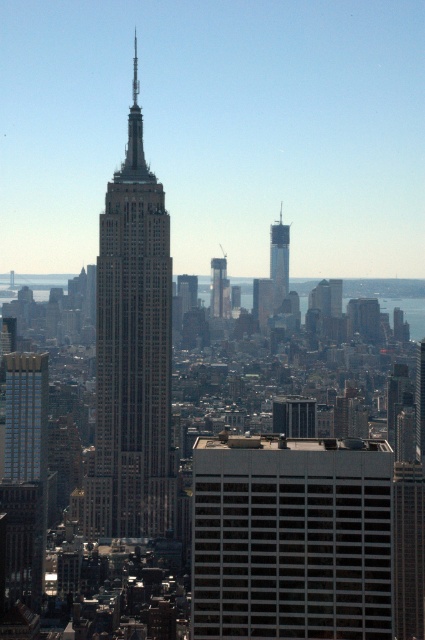
You are an architect analyzing the city layout. You notice the brown stone tower at center and the smooth glass skyscraper at center. Which of these two buildings is bigger in size?

The brown stone tower at center is larger in size compared to the smooth glass skyscraper at center.

You are a city planner analyzing the skyline. You observe the smooth glass skyscraper at center and the glassy steel skyscraper at center. Which one has a greater height?

The smooth glass skyscraper at center is larger in size than the glassy steel skyscraper at center, so it has a greater height.